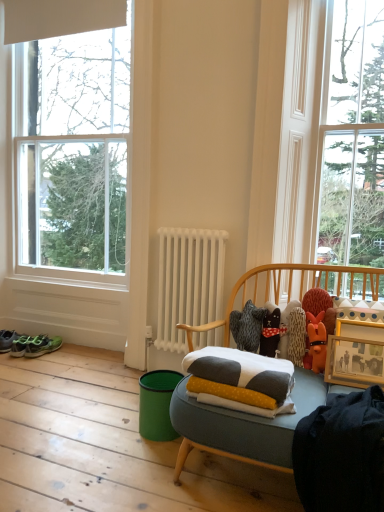
Question: Is clear glass window at upper right, the first window positioned from the right, positioned beyond the bounds of white frame window at left, placed as the second window when sorted from right to left?

Choices:
 (A) yes
 (B) no

Answer: (A)

Question: Can you see clear glass window at upper right, the first window positioned from the right, touching white frame window at left, the 1th window from the left?

Choices:
 (A) yes
 (B) no

Answer: (B)

Question: Does clear glass window at upper right, the second window in the left-to-right sequence, have a greater width compared to white frame window at left, the 1th window from the left?

Choices:
 (A) no
 (B) yes

Answer: (B)

Question: Can you confirm if clear glass window at upper right, the second window in the left-to-right sequence, is thinner than white frame window at left, the 1th window from the left?

Choices:
 (A) no
 (B) yes

Answer: (A)

Question: Would you say white frame window at left, the 1th window from the left, is part of clear glass window at upper right, the first window positioned from the right,'s contents?

Choices:
 (A) yes
 (B) no

Answer: (B)

Question: Is green fabric sneakers at lower left wider or thinner than white frame window at left, placed as the second window when sorted from right to left?

Choices:
 (A) thin
 (B) wide

Answer: (B)

Question: Considering the positions of green fabric sneakers at lower left and white frame window at left, placed as the second window when sorted from right to left, in the image, is green fabric sneakers at lower left taller or shorter than white frame window at left, placed as the second window when sorted from right to left,?

Choices:
 (A) tall
 (B) short

Answer: (B)

Question: Is green fabric sneakers at lower left bigger or smaller than white frame window at left, placed as the second window when sorted from right to left?

Choices:
 (A) small
 (B) big

Answer: (A)

Question: Is green fabric sneakers at lower left inside the boundaries of white frame window at left, the 1th window from the left, or outside?

Choices:
 (A) outside
 (B) inside

Answer: (A)

Question: From a real-world perspective, is knitted plush bear at center above or below clear glass window at upper right, the first window positioned from the right?

Choices:
 (A) above
 (B) below

Answer: (B)

Question: Based on their sizes in the image, would you say knitted plush bear at center is bigger or smaller than clear glass window at upper right, the second window in the left-to-right sequence?

Choices:
 (A) big
 (B) small

Answer: (B)

Question: Considering the positions of knitted plush bear at center and clear glass window at upper right, the second window in the left-to-right sequence, in the image, is knitted plush bear at center wider or thinner than clear glass window at upper right, the second window in the left-to-right sequence,?

Choices:
 (A) thin
 (B) wide

Answer: (A)

Question: Considering the positions of knitted plush bear at center and clear glass window at upper right, the second window in the left-to-right sequence, in the image, is knitted plush bear at center taller or shorter than clear glass window at upper right, the second window in the left-to-right sequence,?

Choices:
 (A) tall
 (B) short

Answer: (B)

Question: Relative to green matte running shoe at lower left, is wooden picture frame at right in front or behind?

Choices:
 (A) front
 (B) behind

Answer: (A)

Question: Considering the relative positions of wooden picture frame at right and green matte running shoe at lower left in the image provided, is wooden picture frame at right to the left or to the right of green matte running shoe at lower left?

Choices:
 (A) right
 (B) left

Answer: (A)